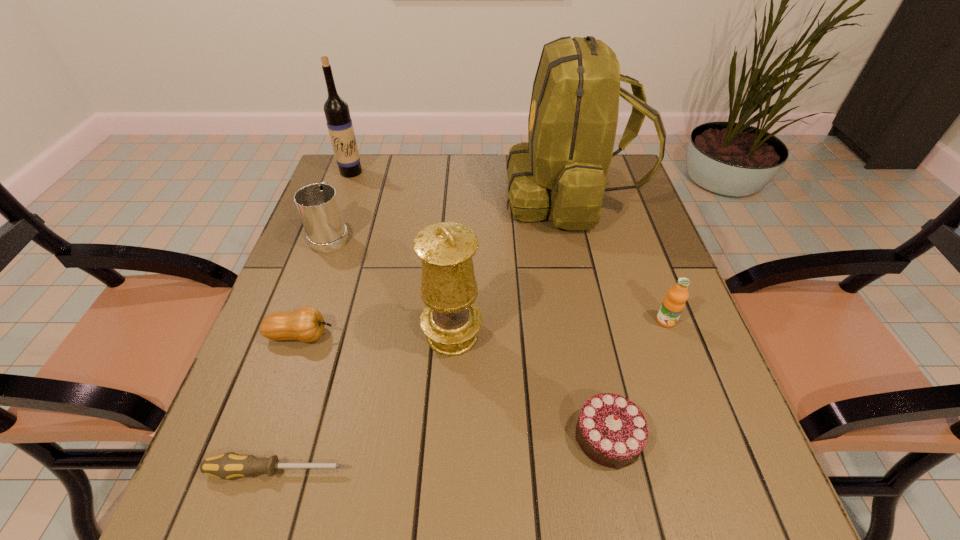
Locate an element on the screen. free spot located on the front-facing side of the backpack is located at coordinates (461, 195).

Identify the location of vacant space located 0.140m on the front-facing side of the backpack. The height and width of the screenshot is (540, 960). (457, 195).

This screenshot has width=960, height=540. I want to click on vacant space situated on the label of the wine bottle, so click(323, 251).

You are a GUI agent. You are given a task and a screenshot of the screen. Output one action in this format:
    pyautogui.click(x=<x>, y=<y>)
    Task: Click on the vacant position located 0.330m on the left of the fourth object from right to left
    This screenshot has width=960, height=540.
    Given the screenshot: What is the action you would take?
    pyautogui.click(x=268, y=335)

Find the location of `vacant space located 0.190m on the side of the mug with the handle`. vacant space located 0.190m on the side of the mug with the handle is located at coordinates (351, 178).

Locate an element on the screen. This screenshot has width=960, height=540. vacant space situated on the side of the mug with the handle is located at coordinates (348, 187).

Where is `free space located 0.100m on the side of the mug with the handle`? The width and height of the screenshot is (960, 540). free space located 0.100m on the side of the mug with the handle is located at coordinates (345, 195).

Locate an element on the screen. The image size is (960, 540). free region located on the label of the orange juice is located at coordinates (741, 523).

Identify the location of free space located 0.350m on the stem side of the gourd. The image size is (960, 540). (499, 335).

At what (x,y) coordinates should I click in order to perform the action: click on vacant space located 0.390m on the back of the chocolate cake. Please return your answer as a coordinate pair (x, y). The image size is (960, 540). Looking at the image, I should click on (571, 261).